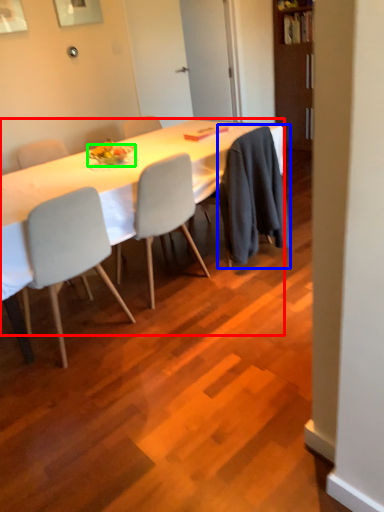
Question: Estimate the real-world distances between objects in this image. Which object is closer to desk (highlighted by a red box), robe (highlighted by a blue box) or plate (highlighted by a green box)?

Choices:
 (A) robe
 (B) plate

Answer: (B)